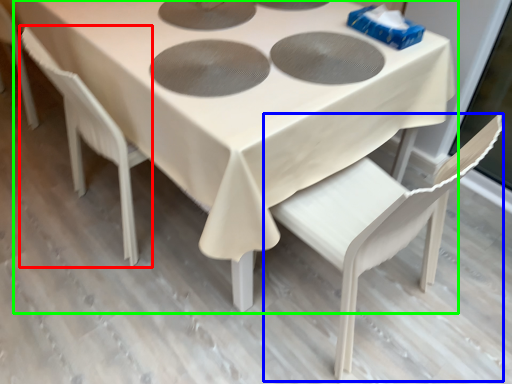
Question: Which is nearer to the chair (highlighted by a red box)? chair (highlighted by a blue box) or table (highlighted by a green box).

Choices:
 (A) chair
 (B) table

Answer: (B)